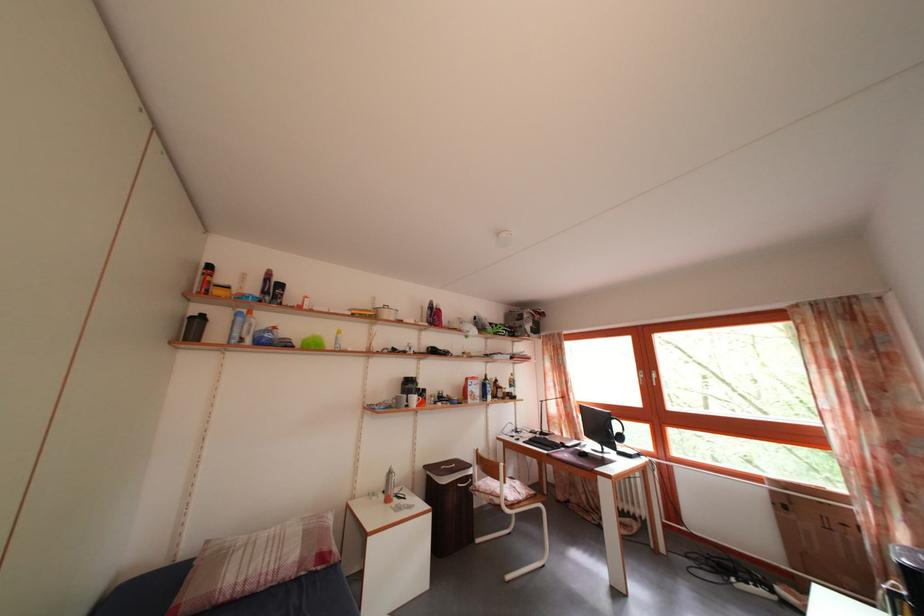
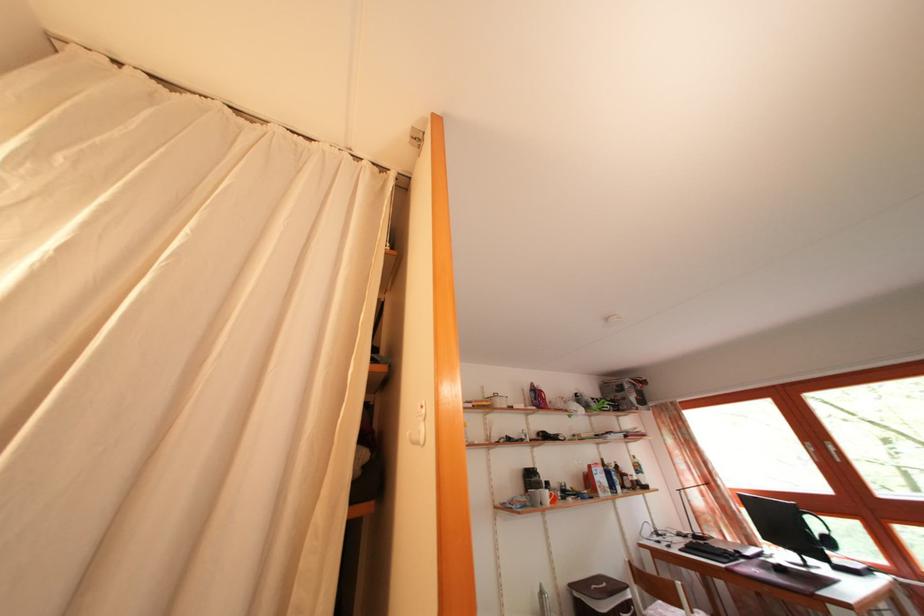
Question: How did the camera likely rotate?

Choices:
 (A) Left
 (B) Right
 (C) Up
 (D) Down

Answer: (C)